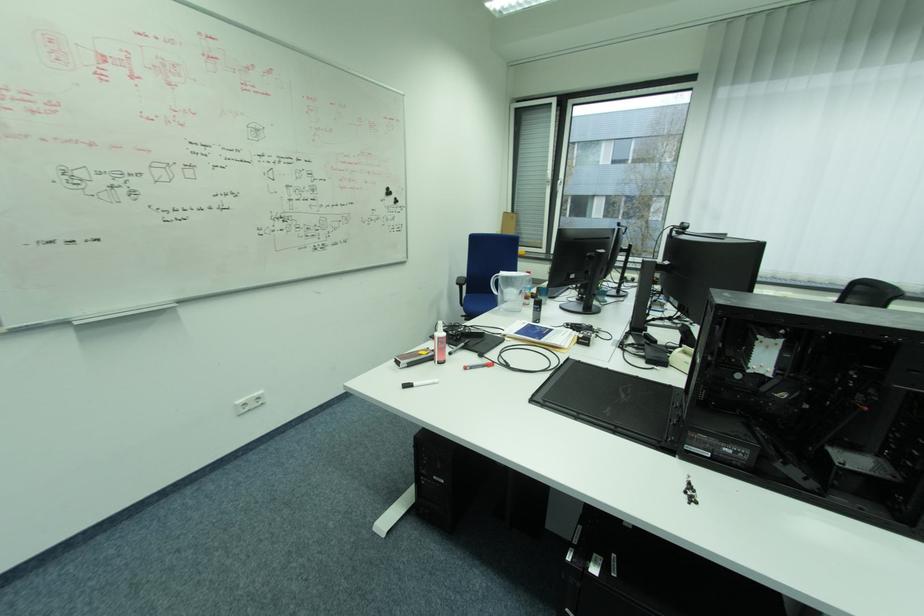
This screenshot has width=924, height=616. Find the location of `window handle`. window handle is located at coordinates (548, 176).